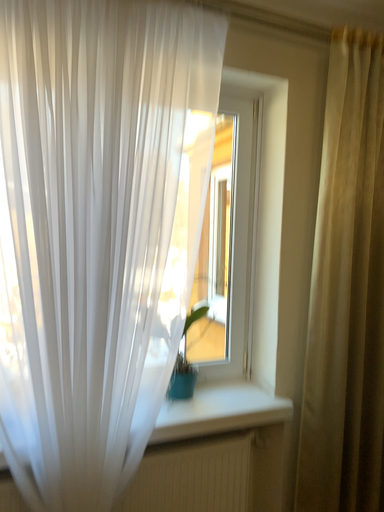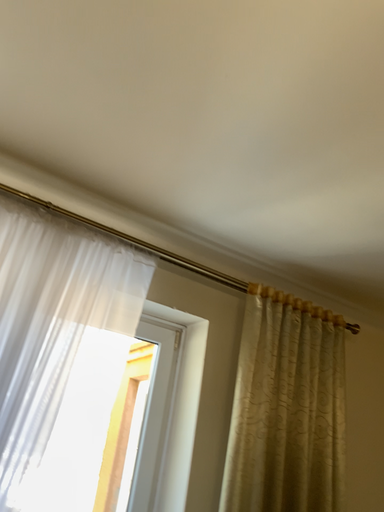
Question: Which way did the camera rotate in the video?

Choices:
 (A) rotated downward
 (B) rotated upward

Answer: (B)